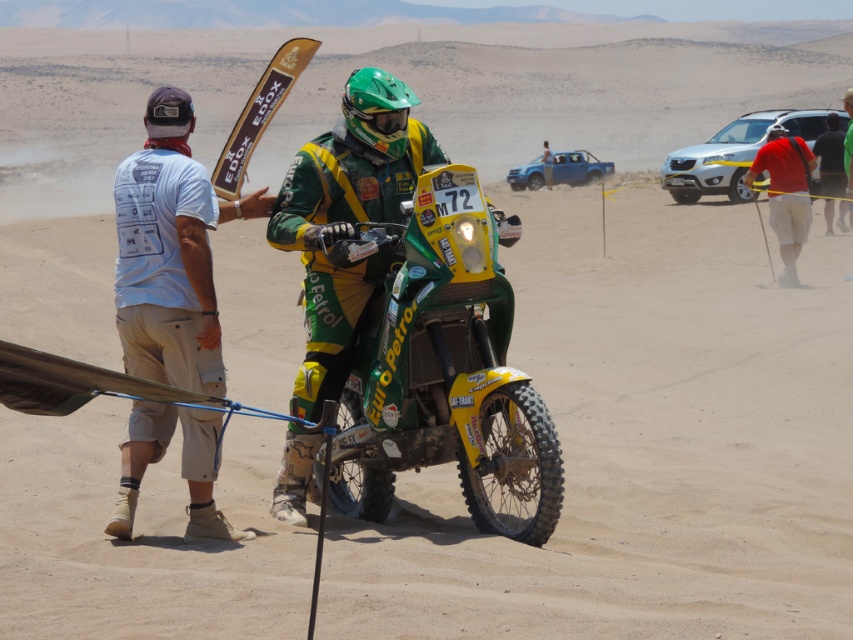
Is white cotton shirt at left bigger than silver metallic suv at right?

Actually, white cotton shirt at left might be smaller than silver metallic suv at right.

Is white cotton shirt at left wider than silver metallic suv at right?

No.

Who is more distant from viewer, (120,257) or (813,128)?

Point (813,128)

Image resolution: width=853 pixels, height=640 pixels. I want to click on white cotton shirt at left, so click(170, 252).

Does point (793, 256) come farther from viewer compared to point (601, 168)?

That is False.

Is red cotton shorts at right thinner than blue metallic truck at upper center?

No, red cotton shorts at right is not thinner than blue metallic truck at upper center.

Is point (807, 148) positioned after point (589, 170)?

No.

Locate an element on the screen. The height and width of the screenshot is (640, 853). red cotton shorts at right is located at coordinates (785, 193).

Who is taller, white cotton shirt at left or blue metallic truck at upper center?

white cotton shirt at left is taller.

Between white cotton shirt at left and blue metallic truck at upper center, which one appears on the left side from the viewer's perspective?

From the viewer's perspective, white cotton shirt at left appears more on the left side.

Is point (192, 220) closer to camera compared to point (509, 180)?

That is True.

Image resolution: width=853 pixels, height=640 pixels. What are the coordinates of `white cotton shirt at left` in the screenshot? It's located at (170, 252).